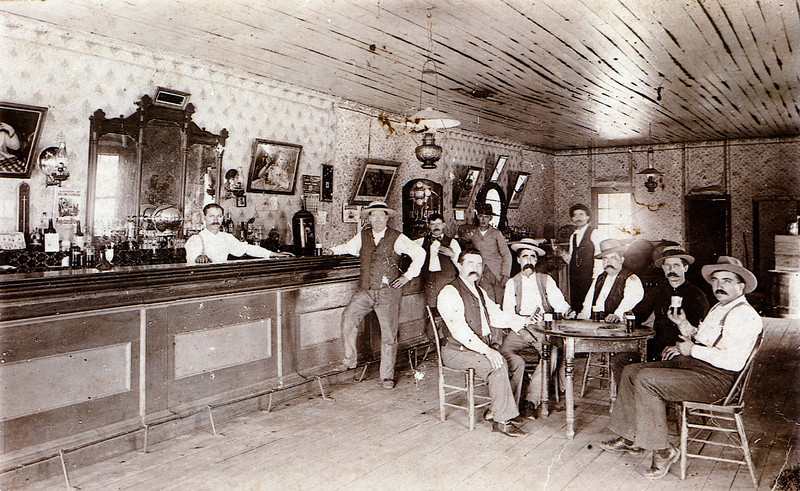
Find the location of a particular element. This screenshot has height=491, width=800. chairs is located at coordinates (717, 431), (474, 400), (594, 380).